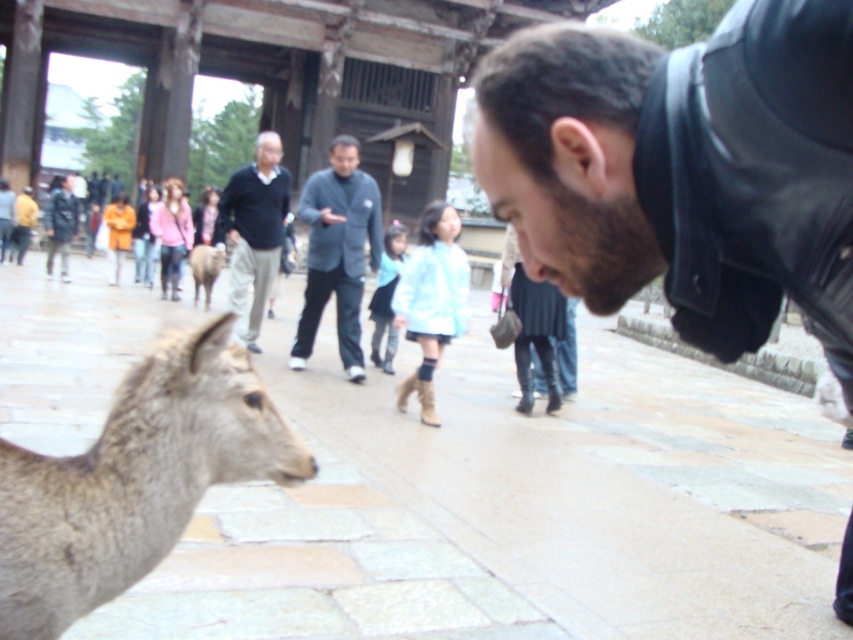
Is the position of black leather jacket at lower right more distant than that of dark blue sweater at center?

No.

Find the location of a particular element. This screenshot has width=853, height=640. black leather jacket at lower right is located at coordinates 683,170.

Is point (328, 240) positioned behind point (230, 220)?

No, (328, 240) is in front of (230, 220).

In the scene shown: Between dark gray suit at center and dark blue sweater at center, which one has less height?

dark blue sweater at center is shorter.

Looking at this image, who is more distant from viewer, [338,252] or [239,225]?

Positioned behind is point [239,225].

You are a GUI agent. You are given a task and a screenshot of the screen. Output one action in this format:
    pyautogui.click(x=<x>, y=<y>)
    Task: Click on the dark gray suit at center
    Image resolution: width=853 pixels, height=640 pixels.
    Given the screenshot: What is the action you would take?
    pyautogui.click(x=337, y=252)

Who is more forward, (747, 145) or (354, 177)?

Point (747, 145)

Which is below, black leather jacket at lower right or dark gray suit at center?

black leather jacket at lower right

Which is behind, point (694, 284) or point (379, 253)?

The point (379, 253) is more distant.

This screenshot has height=640, width=853. Find the location of `black leather jacket at lower right`. black leather jacket at lower right is located at coordinates (683, 170).